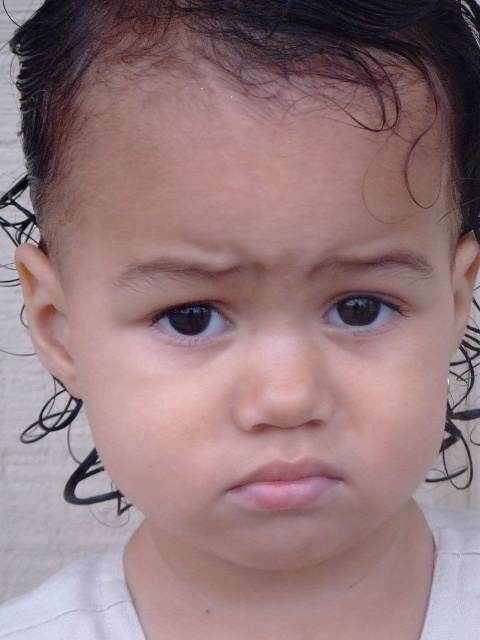
Question: Estimate the real-world distances between objects in this image. Which object is closer to the pink smooth lips at center?

Choices:
 (A) brown glossy eye at center left
 (B) brown glossy eye at center

Answer: (A)

Question: Does brown glossy eye at center appear on the left side of brown glossy eye at center left?

Choices:
 (A) yes
 (B) no

Answer: (B)

Question: In this image, where is pink smooth lips at center located relative to brown glossy eye at center?

Choices:
 (A) below
 (B) above

Answer: (A)

Question: Which of these objects is positioned farthest from the brown glossy eye at center left?

Choices:
 (A) brown glossy eye at center
 (B) pink smooth lips at center

Answer: (B)

Question: Which point is farther to the camera?

Choices:
 (A) (332, 314)
 (B) (294, 492)
 (C) (214, 328)

Answer: (A)

Question: Does pink smooth lips at center have a lesser width compared to brown glossy eye at center left?

Choices:
 (A) yes
 (B) no

Answer: (B)